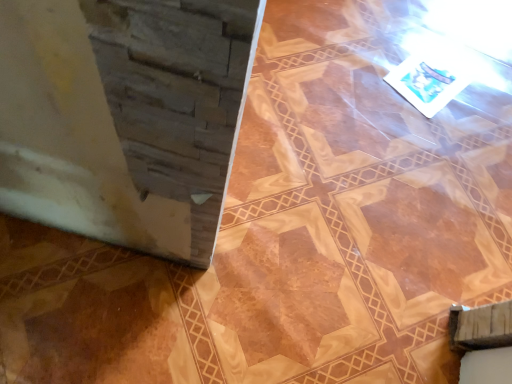
Describe the element at coordinates (352, 221) in the screenshot. I see `stone brickwork at center` at that location.

At what (x,y) coordinates should I click in order to perform the action: click on stone brickwork at center. Please return your answer as a coordinate pair (x, y). Looking at the image, I should click on (352, 221).

Where is `stone brickwork at center`? This screenshot has width=512, height=384. stone brickwork at center is located at coordinates tap(352, 221).